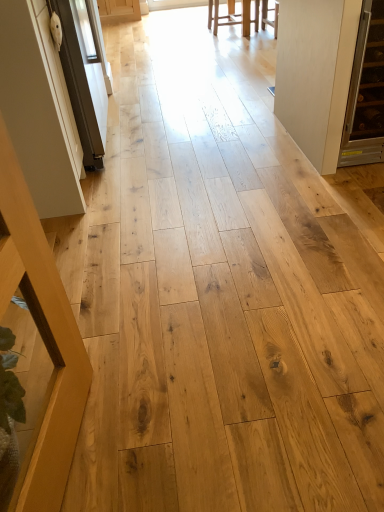
This screenshot has height=512, width=384. In order to click on vacant area that lies between natural wood table at left, which ranks as the first furniture in left-to-right order, and white matte door at right in this screenshot , I will do `click(242, 244)`.